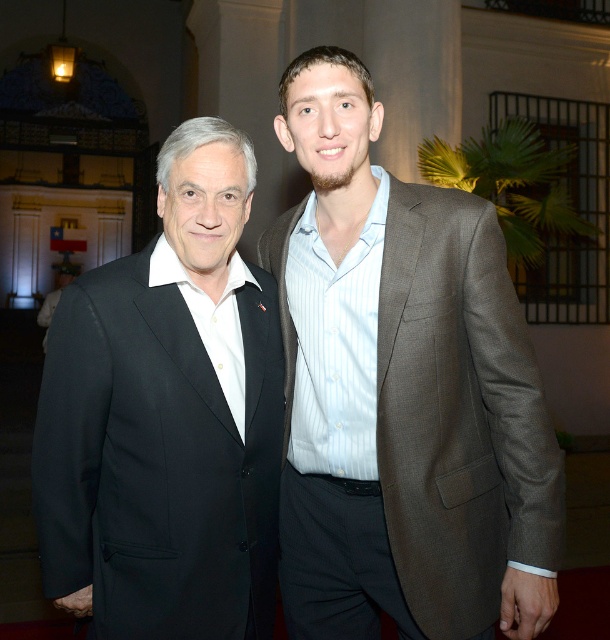
Question: Can you confirm if brown textured suit at center is smaller than black wool suit at left?

Choices:
 (A) yes
 (B) no

Answer: (B)

Question: Which point is farther to the camera?

Choices:
 (A) (398, 451)
 (B) (51, 557)

Answer: (A)

Question: Observing the image, what is the correct spatial positioning of brown textured suit at center in reference to black wool suit at left?

Choices:
 (A) above
 (B) below

Answer: (A)

Question: In this image, where is brown textured suit at center located relative to black wool suit at left?

Choices:
 (A) below
 (B) above

Answer: (B)

Question: Which point appears closest to the camera in this image?

Choices:
 (A) (61, 481)
 (B) (511, 634)

Answer: (A)